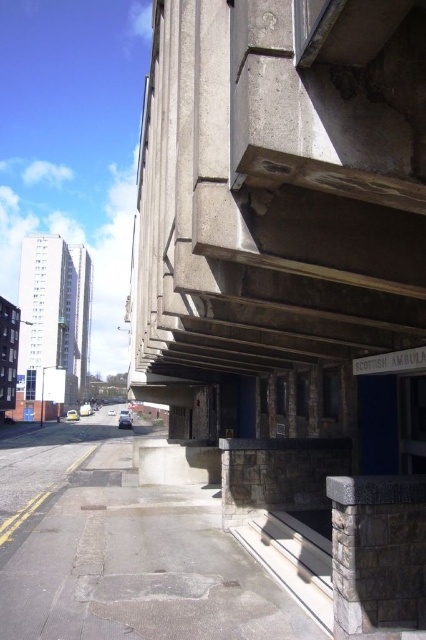
You are a delivery person approaching the Scottish Ambulance entrance on the sidewalk. You see the concrete at upper right and the gray stone pillar at lower right. Which object is nearer to you as you walk towards the entrance?

The concrete at upper right is closer to the viewer than the gray stone pillar at lower right, so the concrete at upper right is nearer to you as you walk towards the entrance.

You are a delivery person trying to park your van near the Scottish Ambulance entrance. The van requires a space larger than the gray stone pillar at lower right. Is there enough space next to the concrete at upper right?

The concrete at upper right is bigger than the gray stone pillar at lower right, so yes, there is enough space next to the concrete at upper right for the van.

You are standing at the entrance of the Scottish Ambulance building and want to walk towards the point labeled as point (357, 584). Which direction should you move relative to the other point labeled point (354, 134)?

Since point (354, 134) is in front of point (357, 584), you should move away from point (354, 134) to reach point (357, 584).